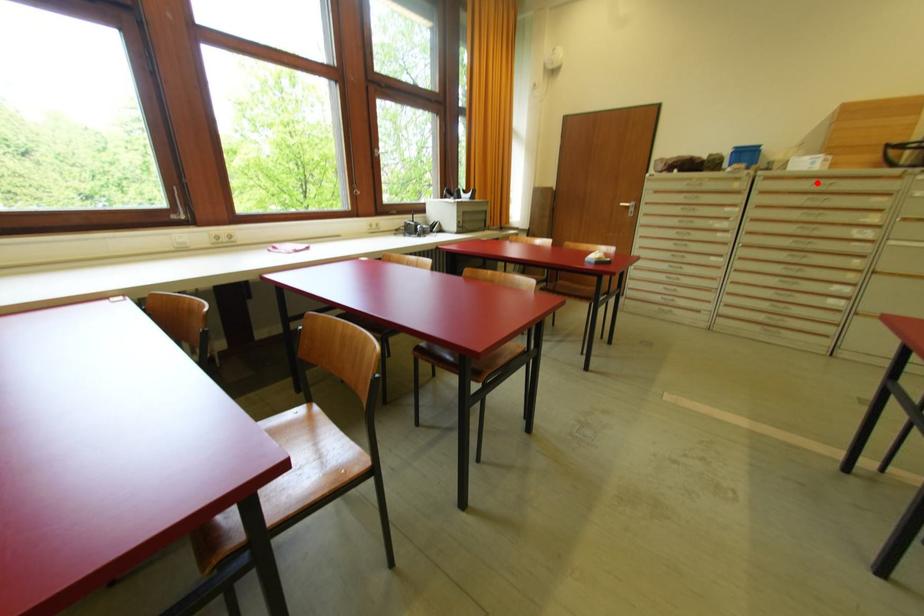
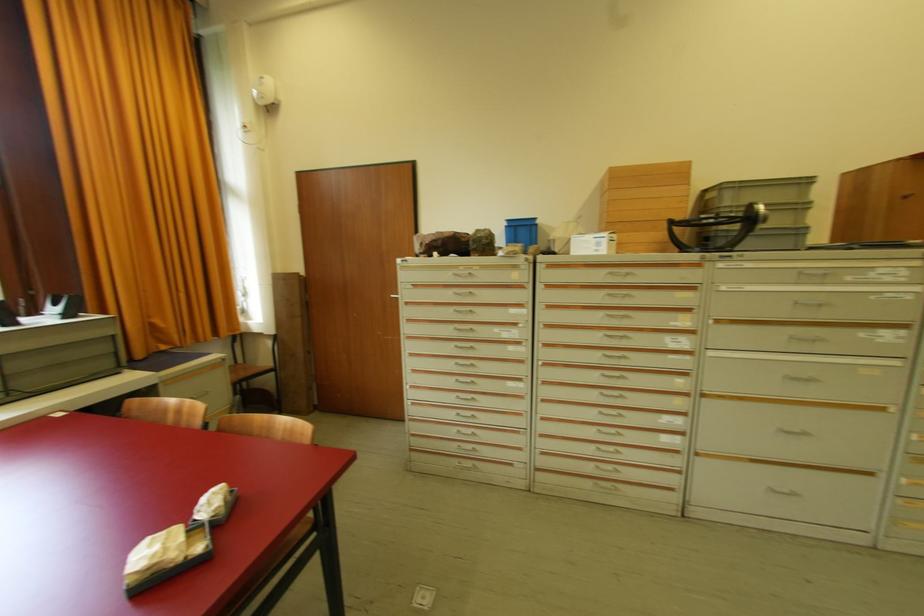
Locate, in the second image, the point that corresponds to the highlighted location in the first image.

(610, 273)